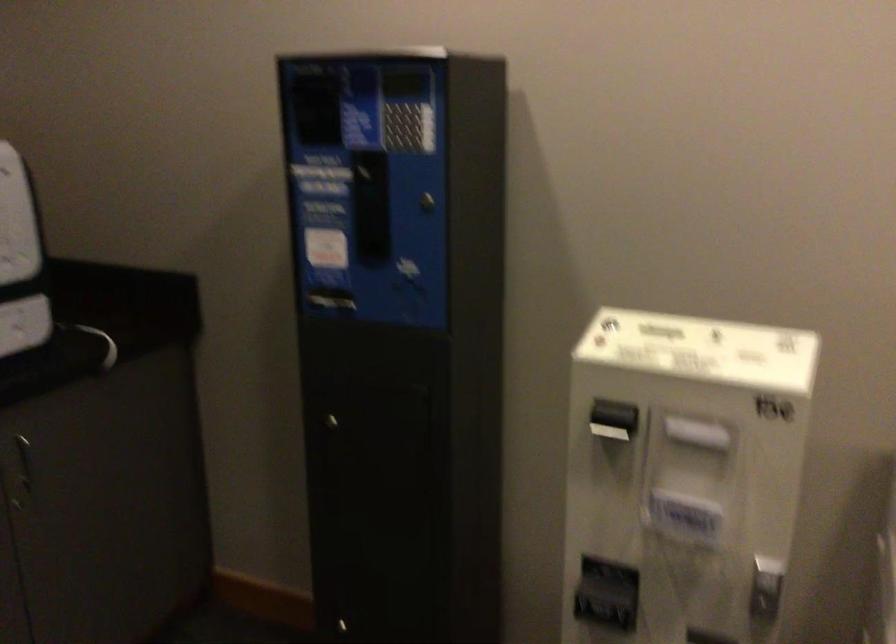
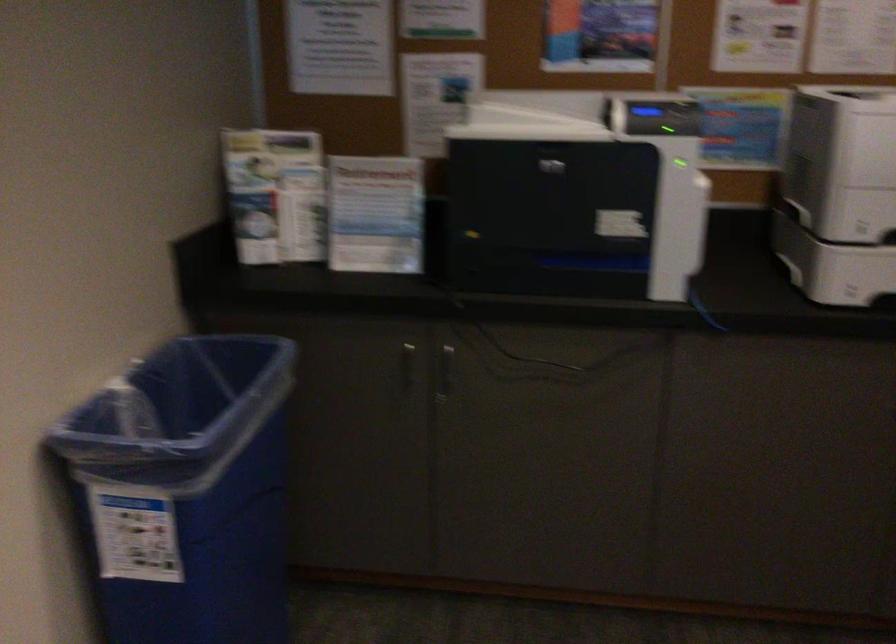
Question: The camera is either moving clockwise (left) or counter-clockwise (right) around the object. The first image is from the beginning of the video and the second image is from the end. Is the camera moving left or right when shooting the video?

Choices:
 (A) Left
 (B) Right

Answer: (B)